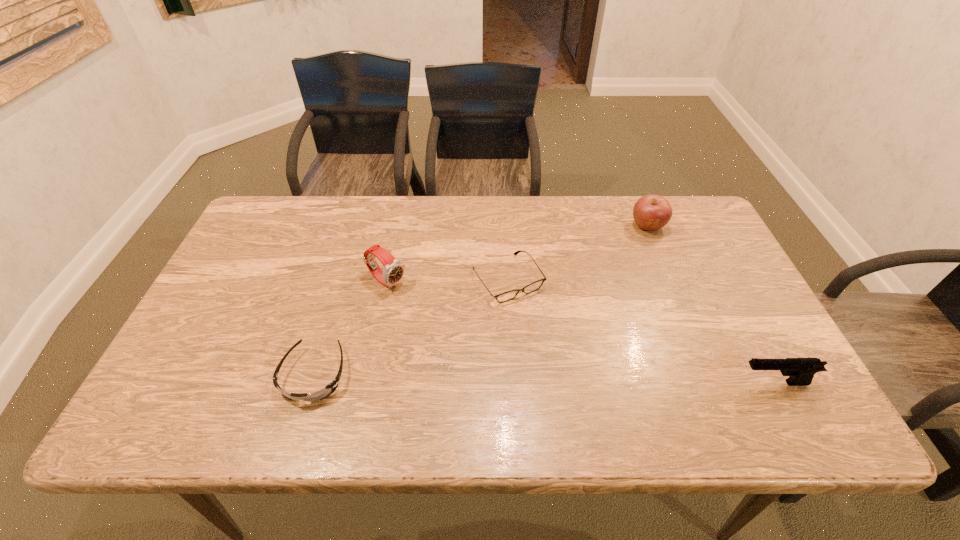
The width and height of the screenshot is (960, 540). In order to click on vacant area situated on the side of the farthest object with the unique marking in this screenshot , I will do `click(627, 265)`.

You are a GUI agent. You are given a task and a screenshot of the screen. Output one action in this format:
    pyautogui.click(x=<x>, y=<y>)
    Task: Click on the free region located on the side of the farthest object with the unique marking
    
    Given the screenshot: What is the action you would take?
    pyautogui.click(x=607, y=304)

The height and width of the screenshot is (540, 960). Identify the location of free space located 0.220m on the side of the farthest object with the unique marking. (619, 280).

Where is `free spot located 0.090m on the face of the watch`? This screenshot has height=540, width=960. free spot located 0.090m on the face of the watch is located at coordinates point(424,307).

Locate an element on the screen. vacant space located on the face of the watch is located at coordinates (450, 324).

Image resolution: width=960 pixels, height=540 pixels. I want to click on free space located 0.340m on the face of the watch, so click(500, 358).

Locate an element on the screen. object present at the far edge is located at coordinates (651, 212).

Identify the location of sunglasses located in the near edge section of the desktop. (329, 389).

What are the coordinates of `pistol at the near edge` in the screenshot? It's located at (801, 371).

At what (x,y) coordinates should I click in order to perform the action: click on pistol present at the right edge. Please return your answer as a coordinate pair (x, y). This screenshot has height=540, width=960. Looking at the image, I should click on (801, 371).